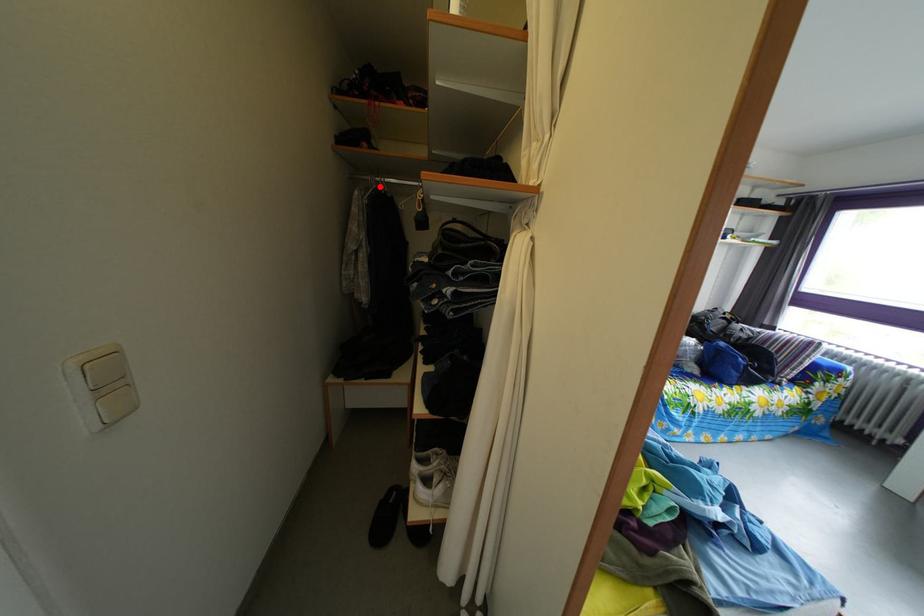
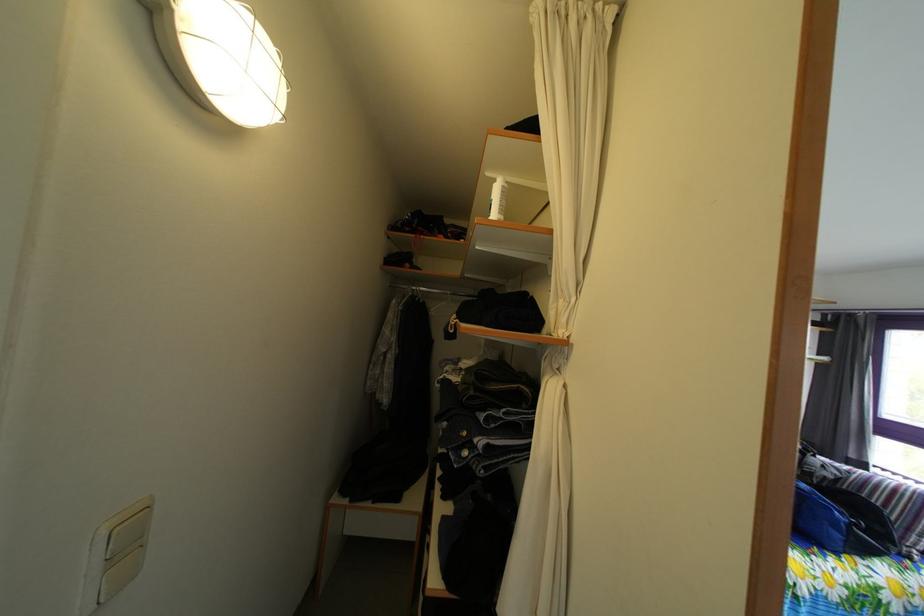
In the second image, find the point that corresponds to the highlighted location in the first image.

(418, 294)